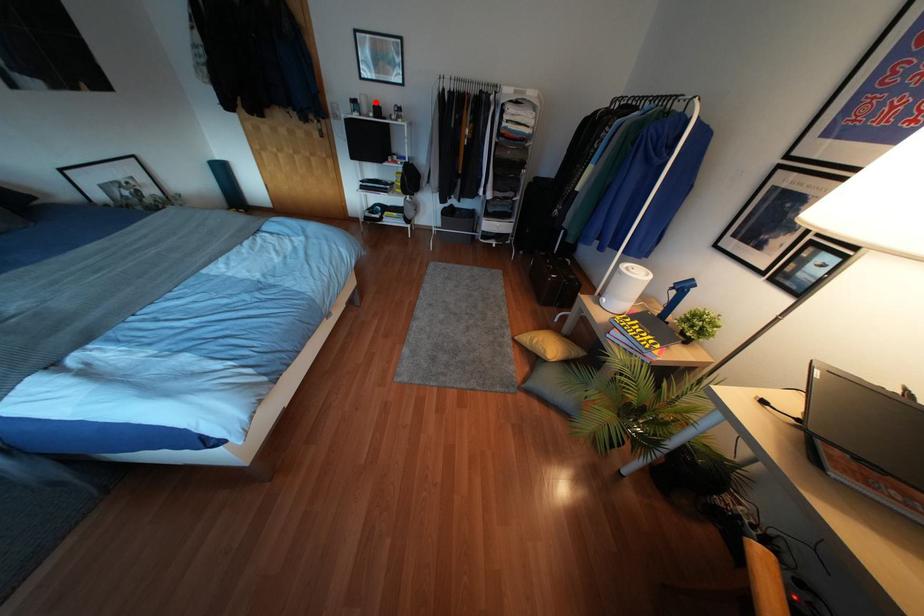
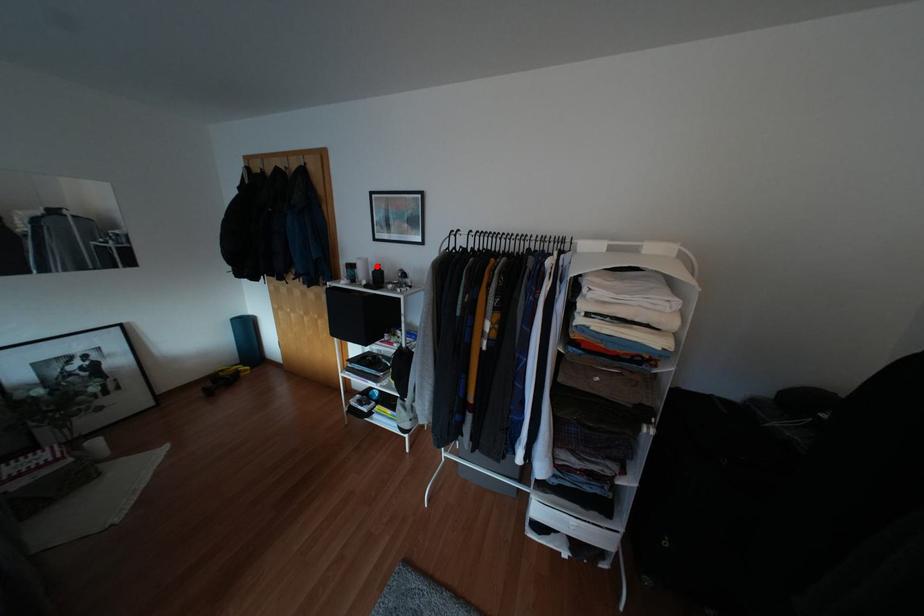
I am providing you with two images of the same scene from different viewpoints. A red point is marked on the first image and another point is marked on the second image. Do the highlighted points in image1 and image2 indicate the same real-world spot?

Yes